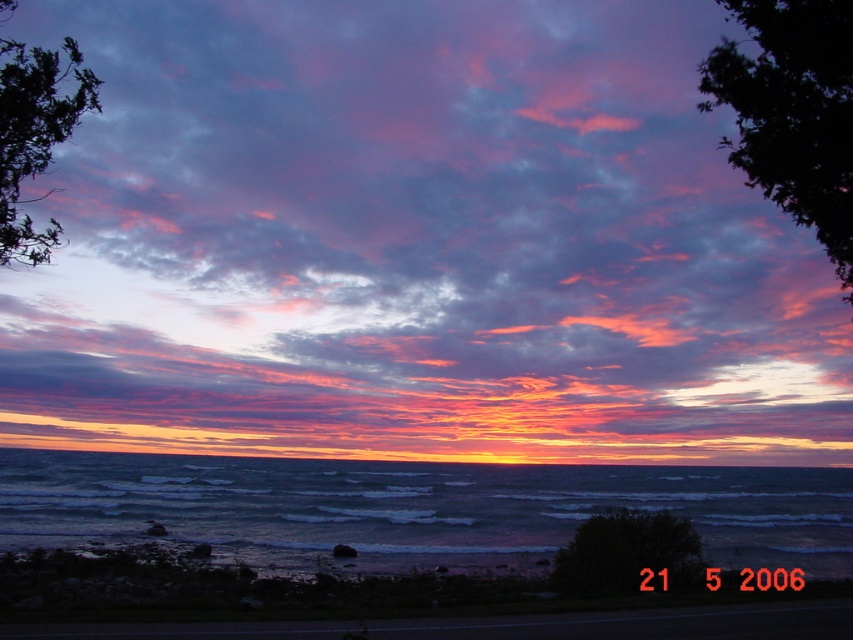
Consider the image. You are an astronomer analyzing the sunset image. You need to locate the vivid pink cotton clouds at center. What are their coordinates in the image?

The vivid pink cotton clouds at center are located at coordinates point (415, 244).

You are standing on the smooth sand shoreline at lower center and want to reach the teal water at lower center. Based on the scene, which direction should you walk to get to the water?

The teal water at lower center is much taller than the smooth sand shoreline at lower center, so you should walk towards the direction where the elevation increases to reach the teal water at lower center.